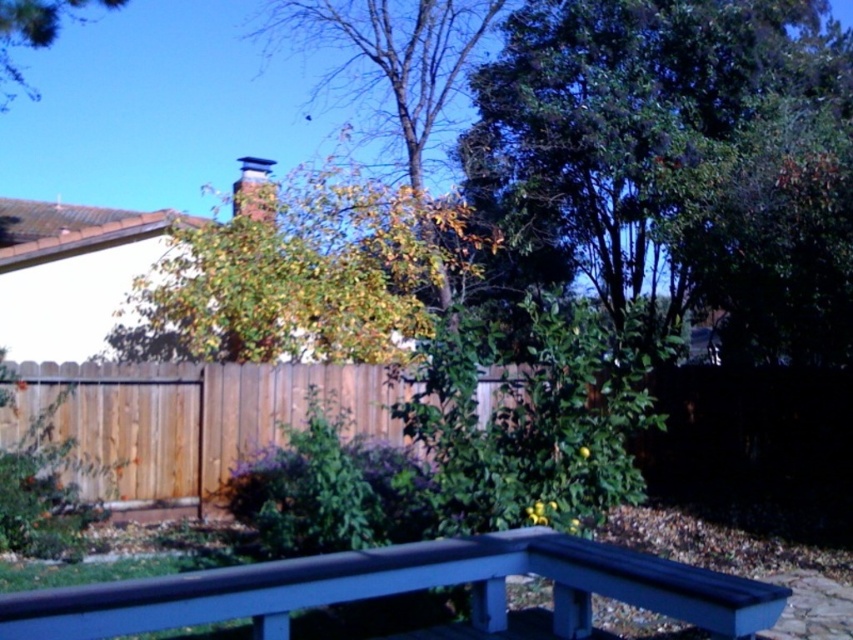
Based on the photo, who is lower down, green leafy tree at upper right or green leafy tree at upper center?

green leafy tree at upper right

Is green leafy tree at upper right taller than green leafy tree at upper center?

Yes, green leafy tree at upper right is taller than green leafy tree at upper center.

Where is `green leafy tree at upper right`? green leafy tree at upper right is located at coordinates (679, 157).

Find the location of `green leafy tree at upper right`. green leafy tree at upper right is located at coordinates (679, 157).

Is green leafy tree at center above brown wood fence at center?

Yes, green leafy tree at center is above brown wood fence at center.

Is green leafy tree at center wider than brown wood fence at center?

Yes.

Describe the element at coordinates (300, 278) in the screenshot. I see `green leafy tree at center` at that location.

The width and height of the screenshot is (853, 640). I want to click on green leafy tree at center, so click(x=300, y=278).

Between point (831, 324) and point (241, 356), which one is positioned behind?

The point (831, 324) is more distant.

Between green leafy tree at upper right and green leafy tree at center, which one is positioned lower?

green leafy tree at center is lower down.

Where is `green leafy tree at upper right`? green leafy tree at upper right is located at coordinates tap(679, 157).